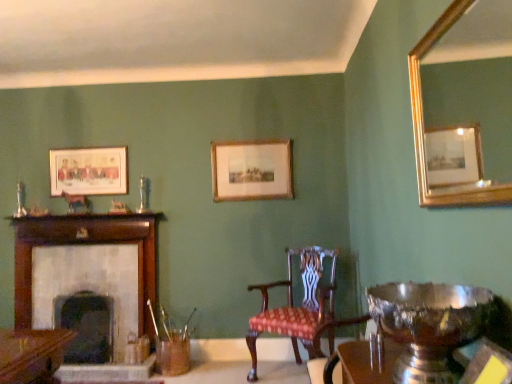
The height and width of the screenshot is (384, 512). Identify the location of free spot above gold-framed picture at center, arranged as the 2th picture frame when viewed from the back (from a real-world perspective). (248, 139).